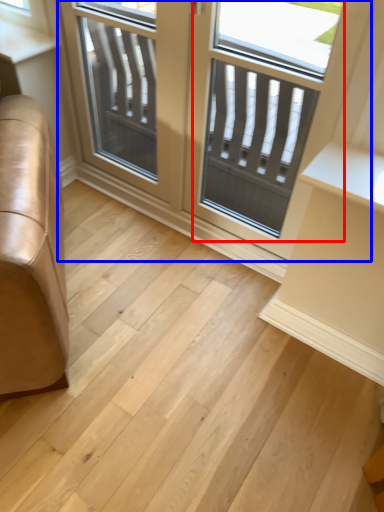
Question: Among these objects, which one is farthest to the camera, screen door (highlighted by a red box) or window (highlighted by a blue box)?

Choices:
 (A) screen door
 (B) window

Answer: (B)